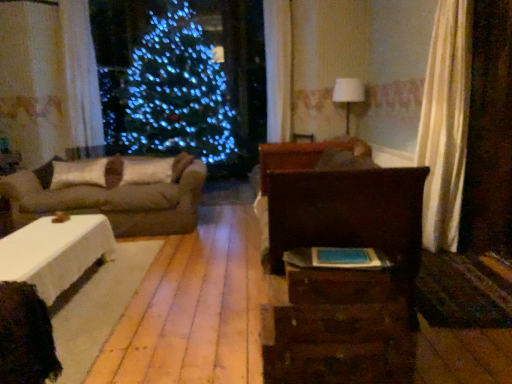
Question: Do you think rustic wood dresser at center is within white matte pillow at left, which ranks as the first pillow in left-to-right order, or outside of it?

Choices:
 (A) inside
 (B) outside

Answer: (B)

Question: Is rustic wood dresser at center to the left or to the right of white matte pillow at left, which is the 2th pillow from right to left, in the image?

Choices:
 (A) left
 (B) right

Answer: (B)

Question: Which is nearer to the rustic wood dresser at center?

Choices:
 (A) white matte pillow at left, which is the 2th pillow from right to left
 (B) beige fabric couch at left
 (C) dark wood bed at center
 (D) white sheer curtain at upper left
 (E) white fabric lampshade at upper center

Answer: (C)

Question: Which object is the farthest from the white fabric pillow at left, which is the second pillow from left to right?

Choices:
 (A) wooden drawer at lower right
 (B) beige fabric couch at left
 (C) white fabric lampshade at upper center
 (D) dark wood bed at center
 (E) white sheer curtain at upper left

Answer: (C)